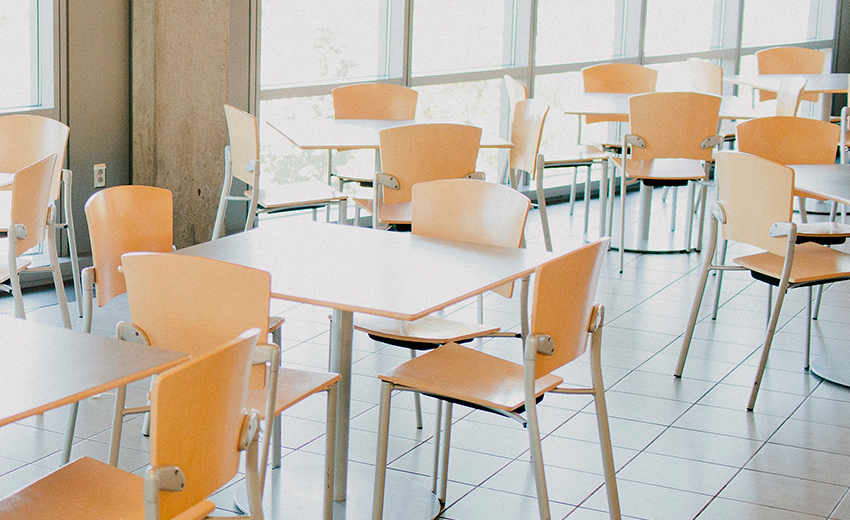
The image size is (850, 520). Find the location of `tables`. tables is located at coordinates (55, 361), (393, 293), (344, 129), (831, 175), (811, 76), (601, 102), (3, 180).